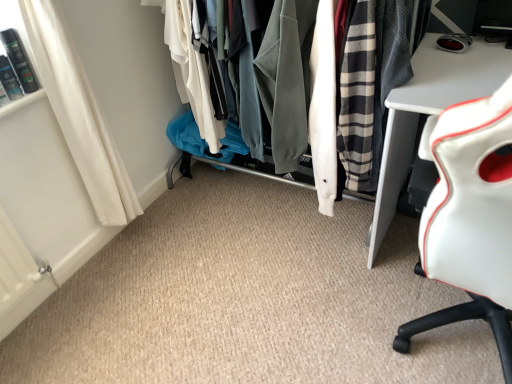
This screenshot has width=512, height=384. What do you see at coordinates (79, 114) in the screenshot?
I see `white fabric curtain at lower left` at bounding box center [79, 114].

This screenshot has height=384, width=512. Find the location of `textured fabric clothes at center`. textured fabric clothes at center is located at coordinates (403, 50).

Find the location of `white fabric curtain at lower left`. white fabric curtain at lower left is located at coordinates (79, 114).

From a real-world perspective, between textured fabric clothes at center and white fabric curtain at lower left, who is vertically lower?

In real-world perspective, textured fabric clothes at center is lower.

Which object is more forward, textured fabric clothes at center or white fabric curtain at lower left?

white fabric curtain at lower left is in front.

What's the angular difference between textured fabric clothes at center and white fabric curtain at lower left's facing directions?

The angle between the facing direction of textured fabric clothes at center and the facing direction of white fabric curtain at lower left is 89.9 degrees.

Does point (346, 150) come closer to viewer compared to point (112, 137)?

Yes, it is.

Is white leather chair at right not inside white fabric curtain at lower left?

Yes.

Is white leather chair at right turned away from white fabric curtain at lower left?

No, white leather chair at right is not facing the opposite direction of white fabric curtain at lower left.

Identify the location of chair on the right of white fabric curtain at lower left. The height and width of the screenshot is (384, 512). (470, 218).

From the image's perspective, which one is positioned higher, white fabric curtain at lower left or white leather chair at right?

white fabric curtain at lower left, from the image's perspective.

From a real-world perspective, between white fabric curtain at lower left and white leather chair at right, who is vertically lower?

white leather chair at right.

Are white fabric curtain at lower left and white leather chair at right far apart?

white fabric curtain at lower left is positioned a significant distance from white leather chair at right.

Considering the sizes of objects white fabric curtain at lower left and white leather chair at right in the image provided, who is bigger, white fabric curtain at lower left or white leather chair at right?

white leather chair at right is bigger.

Is textured fabric clothes at center far from white leather chair at right?

Actually, textured fabric clothes at center and white leather chair at right are a little close together.

Considering the sizes of objects textured fabric clothes at center and white leather chair at right in the image provided, who is wider, textured fabric clothes at center or white leather chair at right?

white leather chair at right.

Is textured fabric clothes at center not within white leather chair at right?

textured fabric clothes at center lies outside white leather chair at right's area.

What's the angular difference between white fabric curtain at lower left and textured fabric clothes at center's facing directions?

89.9 degrees.

Is point (42, 26) more distant than point (365, 177)?

No, it is not.

Between white fabric curtain at lower left and textured fabric clothes at center, which one has smaller width?

Thinner between the two is white fabric curtain at lower left.

You are a GUI agent. You are given a task and a screenshot of the screen. Output one action in this format:
    pyautogui.click(x=<x>, y=<y>)
    Task: Click on the curtain above the textured fabric clothes at center (from a real-world perspective)
    The image size is (512, 384).
    Given the screenshot: What is the action you would take?
    pyautogui.click(x=79, y=114)

Which is more to the right, white leather chair at right or textured fabric clothes at center?

From the viewer's perspective, white leather chair at right appears more on the right side.

I want to click on chair in front of the textured fabric clothes at center, so click(470, 218).

Is white leather chair at right smaller than textured fabric clothes at center?

Yes, white leather chair at right is smaller than textured fabric clothes at center.

From their relative heights in the image, would you say white leather chair at right is taller or shorter than textured fabric clothes at center?

Considering their sizes, white leather chair at right has more height than textured fabric clothes at center.

Identify the location of closet below the white fabric curtain at lower left (from a real-world perspective). (403, 50).

This screenshot has width=512, height=384. What are the coordinates of `chair located on the right of white fabric curtain at lower left` in the screenshot? It's located at (470, 218).

Estimate the real-world distances between objects in this image. Which object is closer to white fabric curtain at lower left, white leather chair at right or textured fabric clothes at center?

textured fabric clothes at center is closer to white fabric curtain at lower left.

From the image, which object appears to be nearer to white leather chair at right, white fabric curtain at lower left or textured fabric clothes at center?

The object closer to white leather chair at right is textured fabric clothes at center.

Considering their positions, is textured fabric clothes at center positioned further to white fabric curtain at lower left than white leather chair at right?

white leather chair at right is further to white fabric curtain at lower left.

Based on their spatial positions, is textured fabric clothes at center or white fabric curtain at lower left closer to white leather chair at right?

textured fabric clothes at center is closer to white leather chair at right.

Estimate the real-world distances between objects in this image. Which object is closer to textured fabric clothes at center, white fabric curtain at lower left or white leather chair at right?

Among the two, white leather chair at right is located nearer to textured fabric clothes at center.

Considering their positions, is white leather chair at right positioned further to textured fabric clothes at center than white fabric curtain at lower left?

The object further to textured fabric clothes at center is white fabric curtain at lower left.

Identify the location of closet between white fabric curtain at lower left and white leather chair at right in the horizontal direction. This screenshot has width=512, height=384. (403, 50).